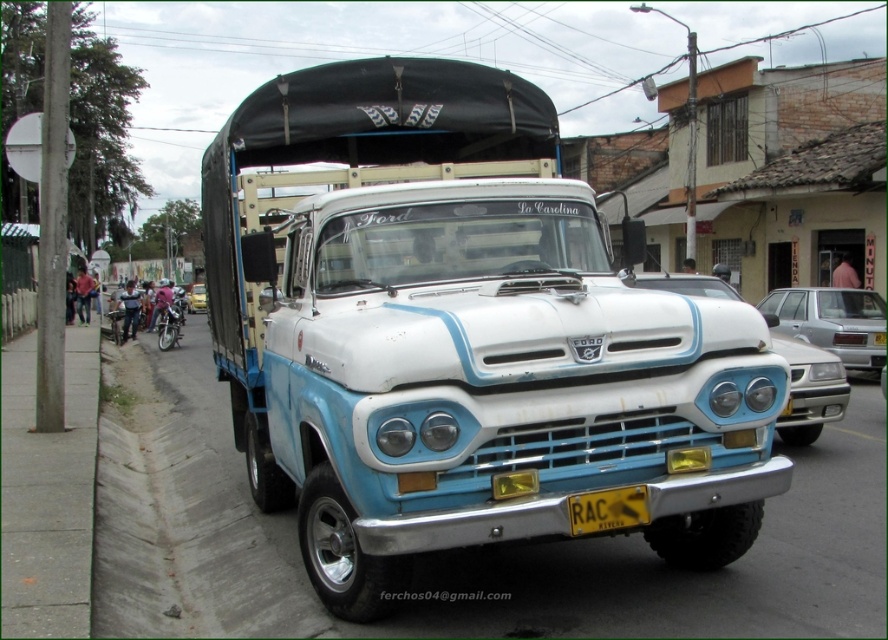
You are a delivery person trying to park your motorcycle between the shiny silver motorcycle at left and the yellow matte license plate at center. Can you fit your motorcycle there?

The yellow matte license plate at center is positioned on the right side of the shiny silver motorcycle at left, so there is no space between them for your motorcycle to fit.

You are a pedestrian standing on the sidewalk. You see a silver metallic sedan at right and a metallic silver car at center. Which one is closer to the ground?

The silver metallic sedan at right is located below the metallic silver car at center, so it is closer to the ground.

You are a delivery person trying to park your motorcycle in front of the vintage Ford truck. The motorcycle needs to be positioned so that it doesn not block the license plate. Based on the scene, where should you place the shiny silver motorcycle at left relative to the yellow matte license plate at center?

The yellow matte license plate at center is below the shiny silver motorcycle at left, so to avoid blocking it, you should position the shiny silver motorcycle at left above the yellow matte license plate at center.